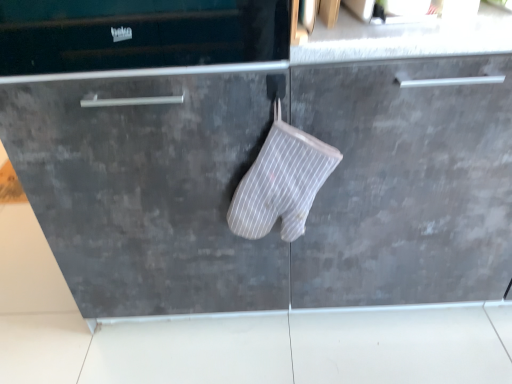
At what (x,y) coordinates should I click in order to perform the action: click on white striped oven mitt at center. Please return your answer as a coordinate pair (x, y). The height and width of the screenshot is (384, 512). Looking at the image, I should click on (281, 182).

Describe the element at coordinates (281, 182) in the screenshot. I see `white striped oven mitt at center` at that location.

You are a GUI agent. You are given a task and a screenshot of the screen. Output one action in this format:
    pyautogui.click(x=<x>, y=<y>)
    Task: Click on the white striped oven mitt at center
    
    Given the screenshot: What is the action you would take?
    pyautogui.click(x=281, y=182)